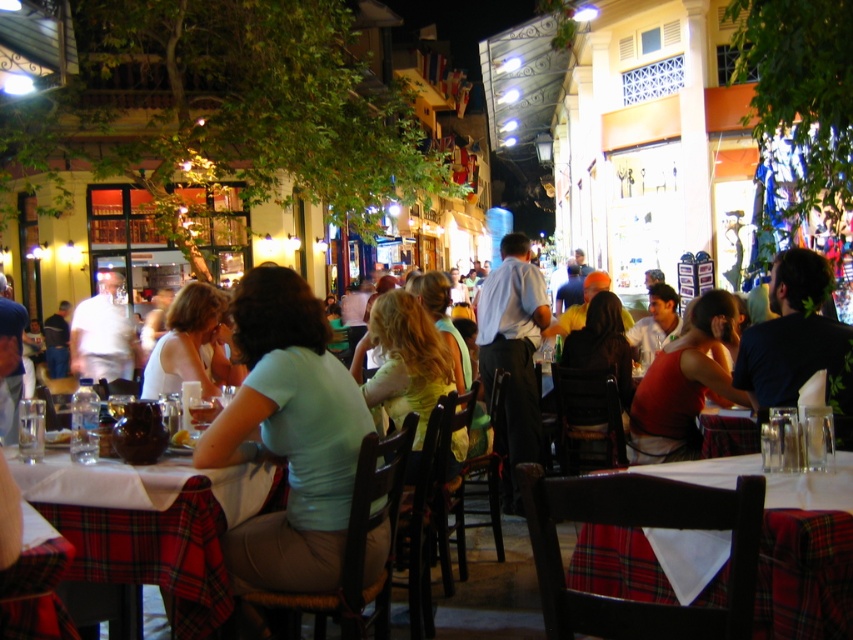
You are a photographer standing at the edge of the dining area. You want to take a photo that includes both the light blue fabric shirt at center and the dark blue shirt at right. Which shirt should you position closer to the left side of your camera frame to ensure both are visible?

To ensure both the light blue fabric shirt at center and the dark blue shirt at right are visible, position the light blue fabric shirt at center on the left side of the frame since it is already to the left of the dark blue shirt at right in the scene.

You are a photographer at the scene and want to capture both the matte red dress at center and the white shirt at center in the same frame. Which one should you position closer to the left side of your camera viewfinder to ensure both are in the shot?

You should position the white shirt at center closer to the left side of your camera viewfinder because the matte red dress at center is to the right of the white shirt at center.

You are a photographer setting up for an event. You need to place a camera stand between the light blue fabric shirt at center and the dark blue shirt at right. Considering their sizes, which shirt should you position closer to the camera to ensure both are in frame without overlapping?

The light blue fabric shirt at center is wider than the dark blue shirt at right. To prevent overlapping, position the wider light blue fabric shirt at center closer to the camera so it fills the frame appropriately while allowing space for the narrower dark blue shirt at right.